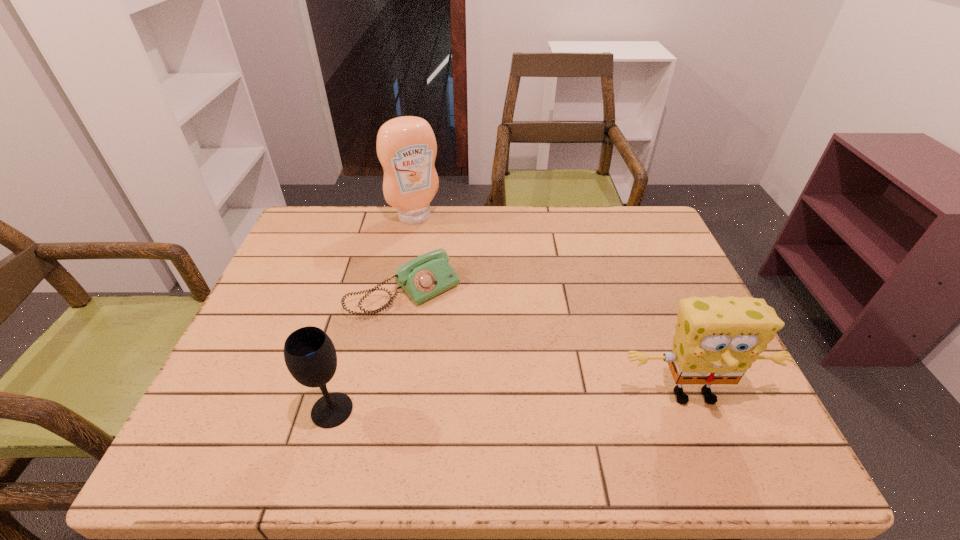
Where is `wineglass`? This screenshot has width=960, height=540. wineglass is located at coordinates (310, 356).

Image resolution: width=960 pixels, height=540 pixels. Find the location of `sponge`. sponge is located at coordinates (716, 340).

Image resolution: width=960 pixels, height=540 pixels. Find the location of `the third nearest object`. the third nearest object is located at coordinates (426, 276).

Where is `the shortest object`? The height and width of the screenshot is (540, 960). the shortest object is located at coordinates (426, 276).

Locate an element on the screen. The width and height of the screenshot is (960, 540). the farthest object is located at coordinates (406, 146).

Identify the location of condiment. (406, 146).

Find the location of `free space located on the right of the wineglass`. free space located on the right of the wineglass is located at coordinates (417, 410).

Find the location of a particular element. free point located 0.060m on the dial of the shortest object is located at coordinates (449, 330).

This screenshot has width=960, height=540. Identify the location of vacant space positioned 0.360m on the dial of the shortest object. point(532,420).

This screenshot has height=540, width=960. I want to click on vacant space located on the dial of the shortest object, so click(456, 338).